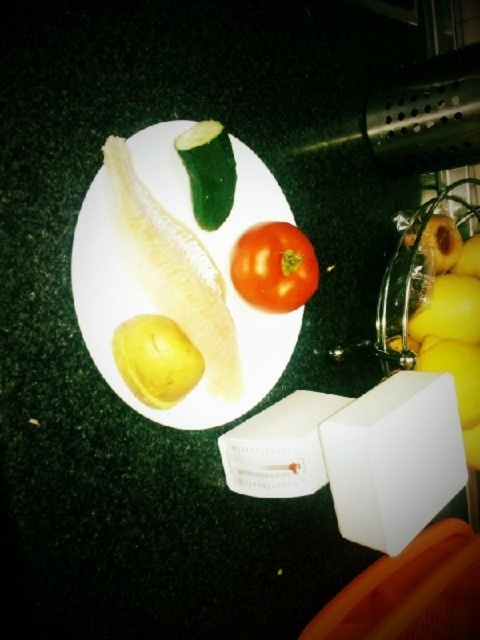
Question: Is matte white plate at center to the right of red matte tomato at center from the viewer's perspective?

Choices:
 (A) yes
 (B) no

Answer: (B)

Question: Which of the following is the farthest from the observer?

Choices:
 (A) matte white plate at center
 (B) green smooth pickled at center
 (C) yellow matte potato at center
 (D) red matte tomato at center

Answer: (D)

Question: Can you confirm if matte white plate at center is wider than green smooth pickled at center?

Choices:
 (A) no
 (B) yes

Answer: (B)

Question: Which point appears closest to the camera in this image?

Choices:
 (A) (457, 358)
 (B) (238, 230)

Answer: (B)

Question: Where is red matte tomato at center located in relation to green smooth pickled at center in the image?

Choices:
 (A) right
 (B) left

Answer: (A)

Question: Which object is farther from the camera taking this photo?

Choices:
 (A) matte white plate at center
 (B) yellow matte bananas at right
 (C) red matte tomato at center
 (D) yellow matte potato at center

Answer: (B)